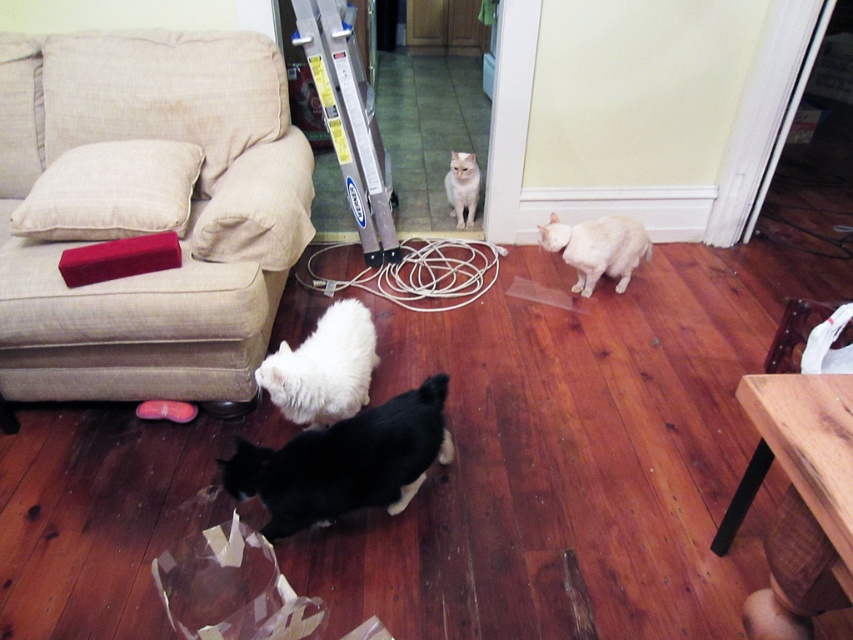
Can you confirm if wooden table at lower right is positioned to the right of white paper bag at lower right?

Indeed, wooden table at lower right is positioned on the right side of white paper bag at lower right.

Does wooden table at lower right have a greater height compared to white paper bag at lower right?

Correct, wooden table at lower right is much taller as white paper bag at lower right.

Between point (762, 465) and point (845, 308), which one is positioned behind?

Point (845, 308)

Where is `wooden table at lower right`? This screenshot has width=853, height=640. wooden table at lower right is located at coordinates (815, 339).

Does wooden table at lower right appear on the left side of white fluffy cat at center?

No, wooden table at lower right is not to the left of white fluffy cat at center.

Is point (749, 488) closer to viewer compared to point (444, 182)?

Yes.

Does point (811, 369) come closer to viewer compared to point (457, 218)?

Yes, point (811, 369) is in front of point (457, 218).

At what (x,y) coordinates should I click in order to perform the action: click on wooden table at lower right. Please return your answer as a coordinate pair (x, y). The height and width of the screenshot is (640, 853). Looking at the image, I should click on (815, 339).

Can you confirm if black fur cat at lower center is shorter than white fluffy cat at center?

In fact, black fur cat at lower center may be taller than white fluffy cat at center.

Does point (392, 451) lie behind point (457, 198)?

No, it is not.

Where is `black fur cat at lower center`? black fur cat at lower center is located at coordinates (344, 461).